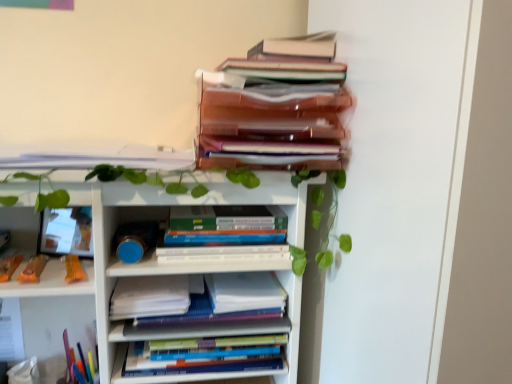
Question: Is white matte bookcase at upper center taller than white paper at upper left, which ranks as the 2th book in top-to-bottom order?

Choices:
 (A) no
 (B) yes

Answer: (B)

Question: Considering the relative positions of white matte bookcase at upper center and white paper at upper left, arranged as the fourth book when ordered from the bottom, in the image provided, is white matte bookcase at upper center in front of white paper at upper left, arranged as the fourth book when ordered from the bottom,?

Choices:
 (A) yes
 (B) no

Answer: (A)

Question: Is white matte bookcase at upper center looking in the opposite direction of white paper at upper left, which ranks as the 2th book in top-to-bottom order?

Choices:
 (A) yes
 (B) no

Answer: (A)

Question: Is white matte bookcase at upper center outside of white paper at upper left, which ranks as the 2th book in top-to-bottom order?

Choices:
 (A) yes
 (B) no

Answer: (A)

Question: Considering the relative positions of white matte bookcase at upper center and white paper at upper left, arranged as the fourth book when ordered from the bottom, in the image provided, is white matte bookcase at upper center to the left of white paper at upper left, arranged as the fourth book when ordered from the bottom, from the viewer's perspective?

Choices:
 (A) yes
 (B) no

Answer: (B)

Question: Can white paper at upper left, which ranks as the 2th book in top-to-bottom order, be found inside white matte bookcase at upper center?

Choices:
 (A) yes
 (B) no

Answer: (B)

Question: Are white paper at center, which ranks as the second paperback book in left-to-right order, and white matte bookcase at upper center making contact?

Choices:
 (A) yes
 (B) no

Answer: (B)

Question: Is white paper at center, which appears as the 1th paperback book when viewed from the right, to the left of white matte bookcase at upper center from the viewer's perspective?

Choices:
 (A) yes
 (B) no

Answer: (B)

Question: Is white paper at center, which ranks as the second paperback book in left-to-right order, outside of white matte bookcase at upper center?

Choices:
 (A) yes
 (B) no

Answer: (A)

Question: Considering the relative sizes of white paper at center, which ranks as the second paperback book in left-to-right order, and white matte bookcase at upper center in the image provided, is white paper at center, which ranks as the second paperback book in left-to-right order, bigger than white matte bookcase at upper center?

Choices:
 (A) no
 (B) yes

Answer: (A)

Question: Is white paper at center, which appears as the 1th paperback book when viewed from the right, facing away from white matte bookcase at upper center?

Choices:
 (A) yes
 (B) no

Answer: (B)

Question: Is white paper at center, which appears as the 1th paperback book when viewed from the right, in front of white matte bookcase at upper center?

Choices:
 (A) yes
 (B) no

Answer: (B)

Question: Can you confirm if white paper at center, the first paperback book viewed from the left, is smaller than white paper at center, which ranks as the second paperback book in left-to-right order?

Choices:
 (A) yes
 (B) no

Answer: (B)